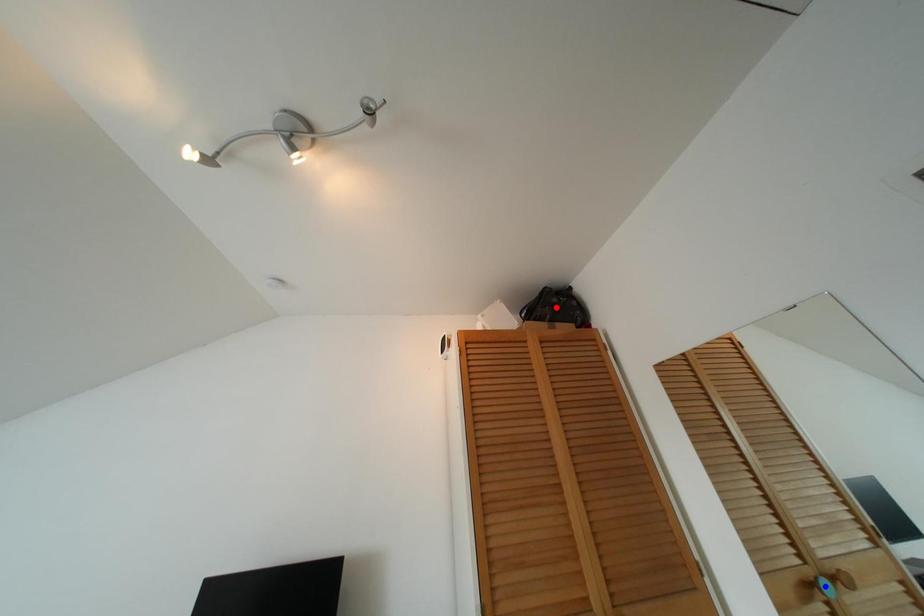
Question: Two points are marked on the image. Which point is closer to the camera?

Choices:
 (A) Blue point is closer.
 (B) Red point is closer.

Answer: (A)